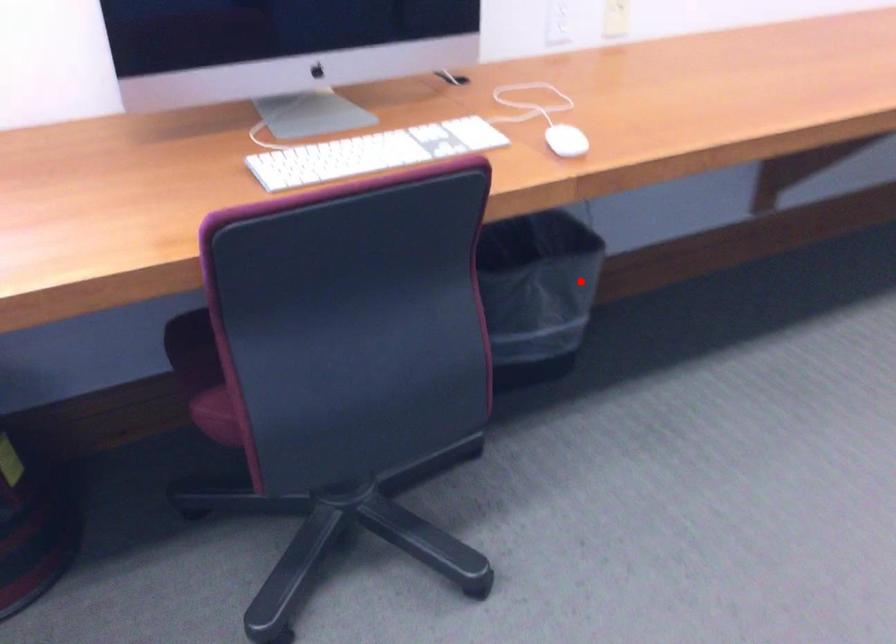
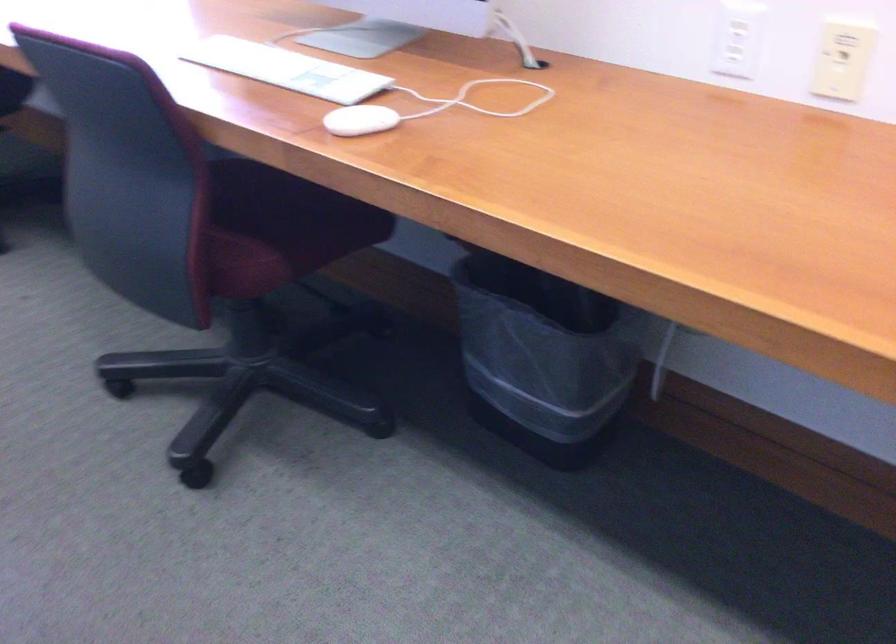
Question: I am providing you with two images of the same scene from different viewpoints. A red point is shown in image1. For the corresponding object point in image2, is it positioned nearer or farther from the camera?

Choices:
 (A) Nearer
 (B) Farther

Answer: (A)